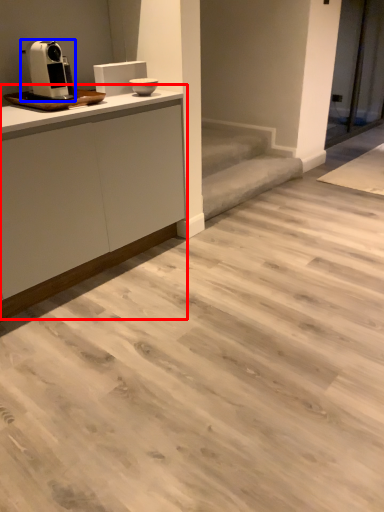
Question: Among these objects, which one is nearest to the camera, cabinetry (highlighted by a red box) or home appliance (highlighted by a blue box)?

Choices:
 (A) cabinetry
 (B) home appliance

Answer: (A)